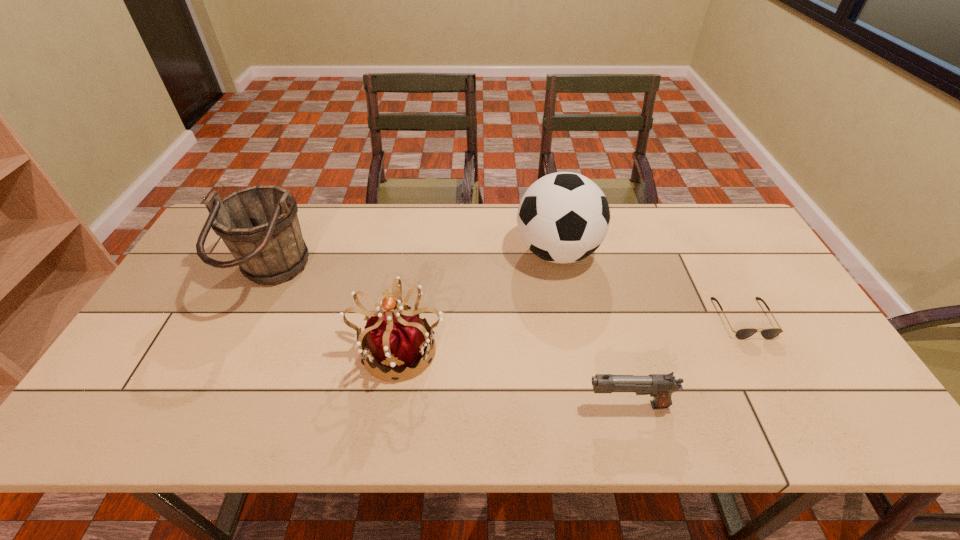
Image resolution: width=960 pixels, height=540 pixels. In the image, there is a desktop. In order to click on blank space at the far edge in this screenshot , I will do `click(613, 230)`.

Where is `vacant space at the near edge`? The image size is (960, 540). vacant space at the near edge is located at coordinates (184, 436).

In the image, there is a desktop. Where is `vacant space at the left edge`? The height and width of the screenshot is (540, 960). vacant space at the left edge is located at coordinates pyautogui.click(x=175, y=370).

The height and width of the screenshot is (540, 960). I want to click on vacant region at the right edge of the desktop, so click(x=803, y=317).

This screenshot has height=540, width=960. I want to click on vacant space at the far right corner, so click(x=726, y=221).

Image resolution: width=960 pixels, height=540 pixels. I want to click on free area in between the fourth tallest object and the shortest object, so click(685, 361).

Find the location of a particular element. The width and height of the screenshot is (960, 540). free space between the fourth object from right to left and the gun is located at coordinates (514, 376).

The width and height of the screenshot is (960, 540). What are the coordinates of `unoccupied area between the soccer ball and the nearest object` in the screenshot? It's located at (592, 328).

Find the location of a particular element. The image size is (960, 540). free space between the shortest object and the second shortest object is located at coordinates (685, 361).

Locate an element on the screen. Image resolution: width=960 pixels, height=540 pixels. vacant area that lies between the leftmost object and the tiara is located at coordinates (335, 313).